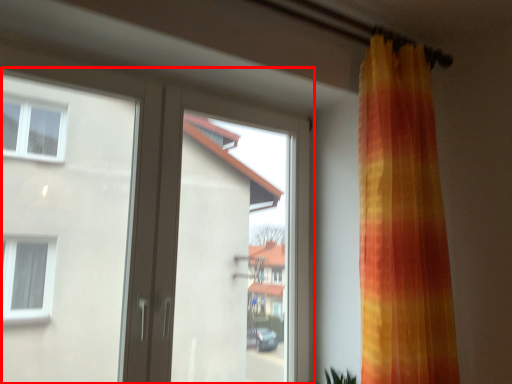
Question: In this image, where is door (annotated by the red box) located relative to window screen?

Choices:
 (A) left
 (B) right

Answer: (A)